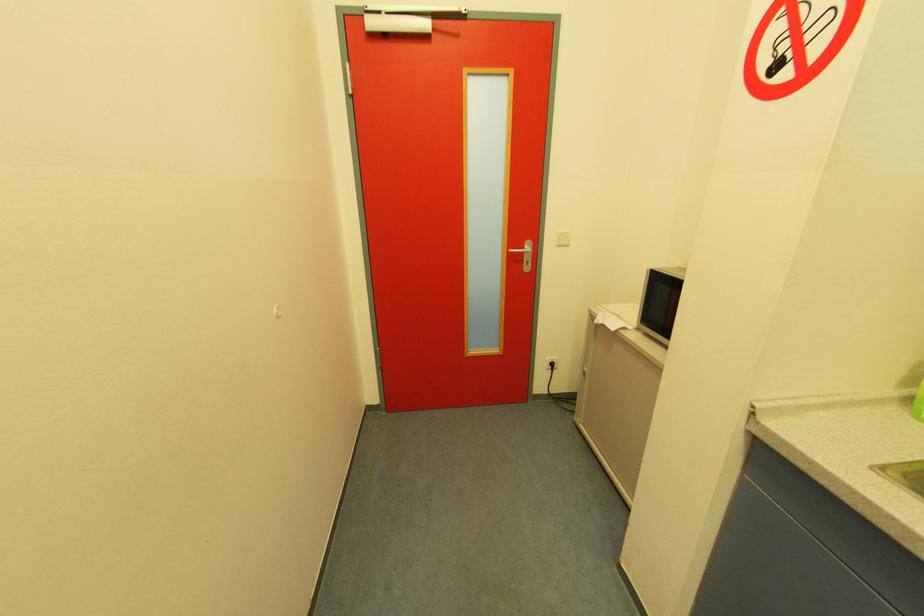
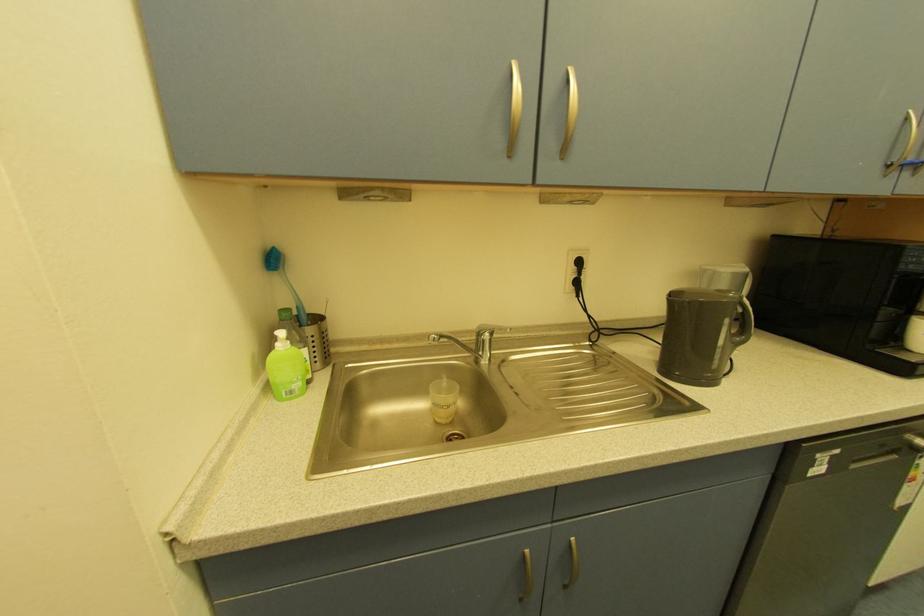
Based on the continuous images, in which direction is the camera rotating?

The rotation direction of the camera is right-down.